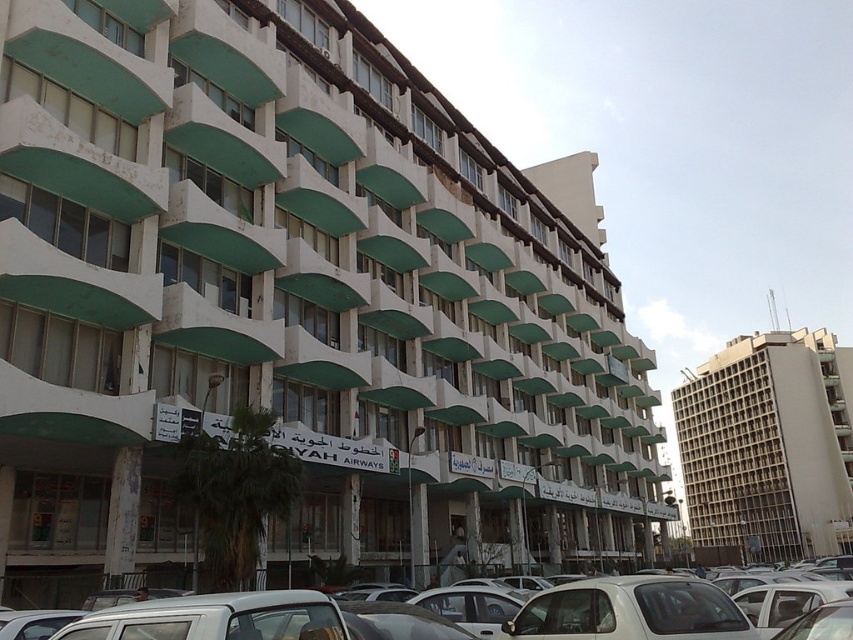
Looking at this image, is white matte car at lower right in front of white matte car at center?

Yes, white matte car at lower right is closer to the viewer.

Can you confirm if white matte car at lower right is bigger than white matte car at center?

Actually, white matte car at lower right might be smaller than white matte car at center.

Between point (639, 580) and point (33, 600), which one is positioned in front?

Positioned in front is point (639, 580).

The height and width of the screenshot is (640, 853). In order to click on white matte car at lower right in this screenshot , I will do `click(630, 611)`.

Can you confirm if beige concrete building at right is thinner than white matte car at center?

In fact, beige concrete building at right might be wider than white matte car at center.

Can you confirm if beige concrete building at right is wider than white matte car at center?

Correct, the width of beige concrete building at right exceeds that of white matte car at center.

This screenshot has height=640, width=853. What are the coordinates of `beige concrete building at right` in the screenshot? It's located at (769, 445).

Between beige concrete building at right and white matte car at lower right, which one has less height?

With less height is white matte car at lower right.

Describe the element at coordinates (769, 445) in the screenshot. The image size is (853, 640). I see `beige concrete building at right` at that location.

Image resolution: width=853 pixels, height=640 pixels. What do you see at coordinates (769, 445) in the screenshot?
I see `beige concrete building at right` at bounding box center [769, 445].

Identify the location of beige concrete building at right. (769, 445).